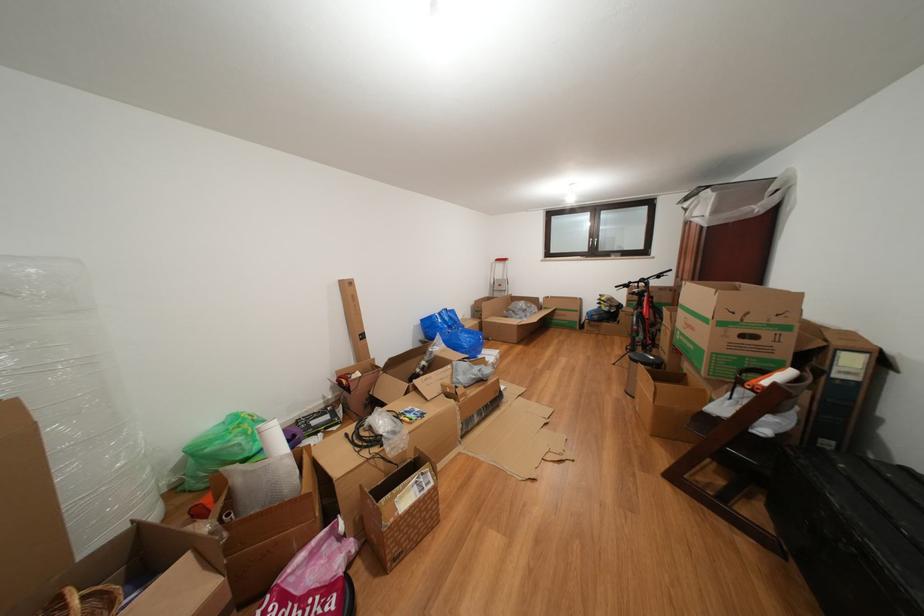
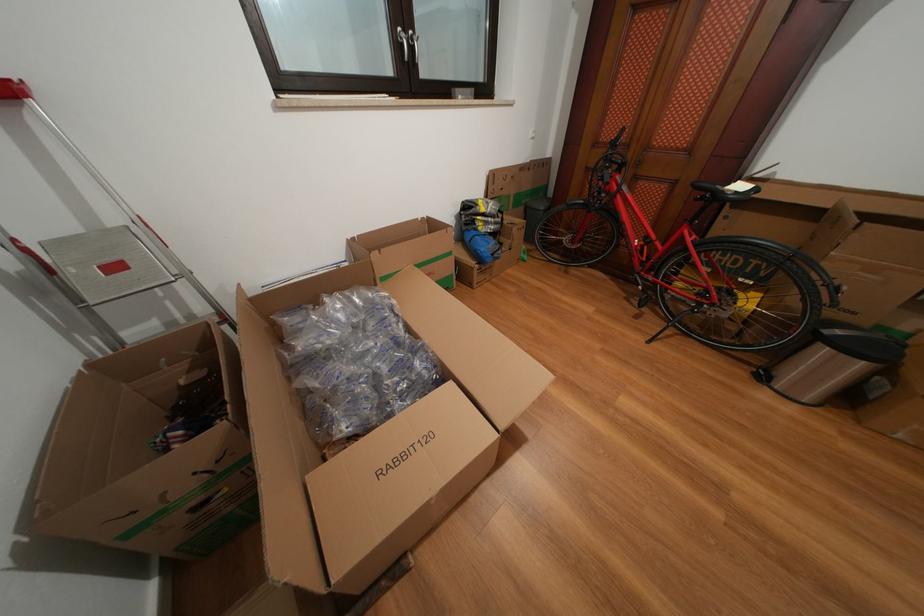
Locate, in the second image, the point that corresponds to (507,291) in the first image.

(124, 273)